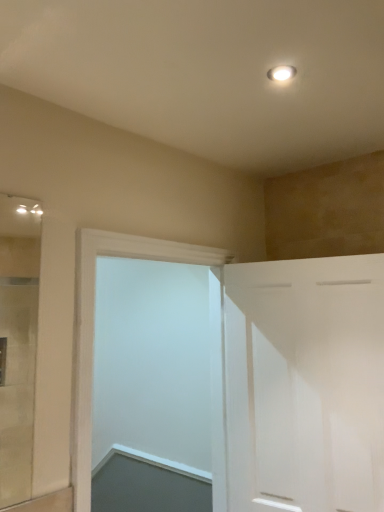
Question: Considering their positions, is white matte cabinet at right, the 2th door from the left, located in front of or behind white smooth door at center, the second door in the right-to-left sequence?

Choices:
 (A) behind
 (B) front

Answer: (A)

Question: From a real-world perspective, relative to white smooth door at center, the second door in the right-to-left sequence, is white matte cabinet at right, arranged as the first door when viewed from the right, vertically above or below?

Choices:
 (A) below
 (B) above

Answer: (A)

Question: In terms of width, does white matte cabinet at right, arranged as the first door when viewed from the right, look wider or thinner when compared to white smooth door at center, acting as the first door starting from the left?

Choices:
 (A) wide
 (B) thin

Answer: (B)

Question: Based on their sizes in the image, would you say white smooth door at center, the second door in the right-to-left sequence, is bigger or smaller than white matte cabinet at right, the 2th door from the left?

Choices:
 (A) big
 (B) small

Answer: (A)

Question: In terms of width, does white smooth door at center, the second door in the right-to-left sequence, look wider or thinner when compared to white matte cabinet at right, the 2th door from the left?

Choices:
 (A) wide
 (B) thin

Answer: (A)

Question: Is white smooth door at center, the second door in the right-to-left sequence, spatially inside white matte cabinet at right, arranged as the first door when viewed from the right, or outside of it?

Choices:
 (A) outside
 (B) inside

Answer: (A)

Question: Considering the positions of white smooth door at center, acting as the first door starting from the left, and white matte cabinet at right, arranged as the first door when viewed from the right, in the image, is white smooth door at center, acting as the first door starting from the left, taller or shorter than white matte cabinet at right, arranged as the first door when viewed from the right,?

Choices:
 (A) short
 (B) tall

Answer: (B)